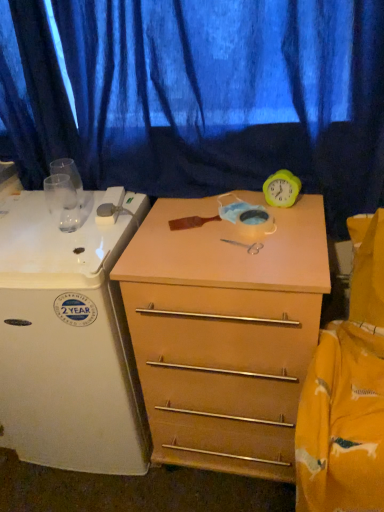
Locate an element on the screen. free space above white glossy refrigerator at left (from a real-world perspective) is located at coordinates (50, 223).